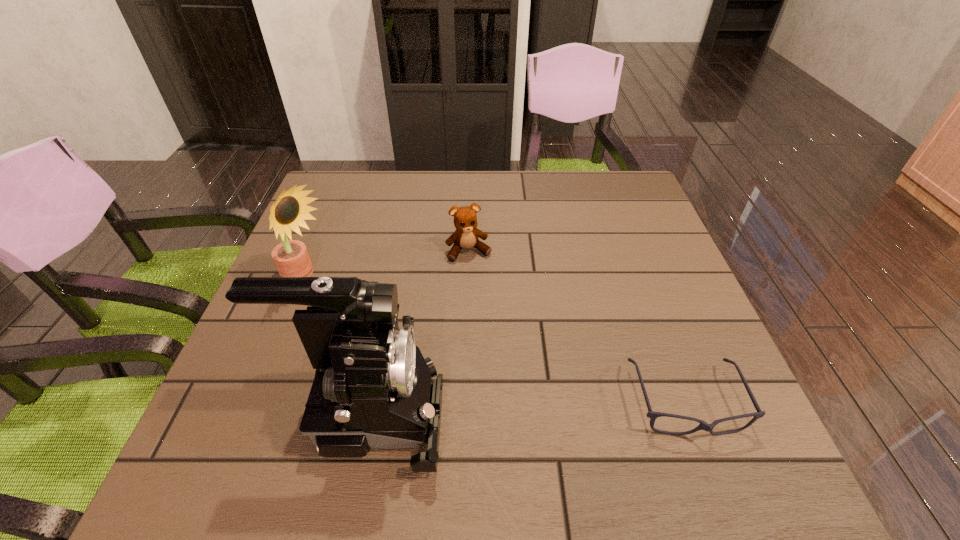
I want to click on vacant point at the far edge, so (x=419, y=178).

Locate an element on the screen. This screenshot has height=540, width=960. vacant space at the near edge of the desktop is located at coordinates (495, 407).

I want to click on vacant area at the left edge, so click(x=319, y=238).

Where is `vacant space at the right edge`? The image size is (960, 540). vacant space at the right edge is located at coordinates (651, 343).

Where is `vacant space at the far left corner of the desktop`? Image resolution: width=960 pixels, height=540 pixels. vacant space at the far left corner of the desktop is located at coordinates (337, 215).

I want to click on vacant space at the near left corner, so click(x=210, y=428).

Locate an element on the screen. The image size is (960, 540). vacant space at the far right corner of the desktop is located at coordinates (636, 174).

You are a GUI agent. You are given a task and a screenshot of the screen. Output one action in this format:
    pyautogui.click(x=<x>, y=<y>)
    Task: Click on the free space between the teddy bear and the shortest object
    This screenshot has width=960, height=540.
    Given the screenshot: What is the action you would take?
    pyautogui.click(x=577, y=327)

I want to click on vacant area that lies between the third shortest object and the teddy bear, so click(387, 266).

Where is `vacant space that is in between the third tallest object and the sunflower`? Image resolution: width=960 pixels, height=540 pixels. vacant space that is in between the third tallest object and the sunflower is located at coordinates pyautogui.click(x=387, y=266).